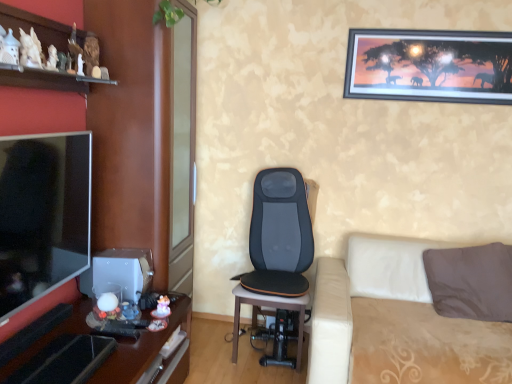
Question: Is metallic-framed picture at upper right thinner than white ceramic figurines at upper left?

Choices:
 (A) no
 (B) yes

Answer: (B)

Question: Does metallic-framed picture at upper right appear on the right side of white ceramic figurines at upper left?

Choices:
 (A) yes
 (B) no

Answer: (A)

Question: Is metallic-framed picture at upper right bigger than white ceramic figurines at upper left?

Choices:
 (A) no
 (B) yes

Answer: (A)

Question: Is metallic-framed picture at upper right beside white ceramic figurines at upper left?

Choices:
 (A) yes
 (B) no

Answer: (B)

Question: Is metallic-framed picture at upper right at the left side of white ceramic figurines at upper left?

Choices:
 (A) yes
 (B) no

Answer: (B)

Question: Is metallic-framed picture at upper right positioned before white ceramic figurines at upper left?

Choices:
 (A) no
 (B) yes

Answer: (A)

Question: From a real-world perspective, is beige fabric studio couch at lower right under black leather massage chair at center?

Choices:
 (A) yes
 (B) no

Answer: (A)

Question: Can you confirm if beige fabric studio couch at lower right is positioned to the right of black leather massage chair at center?

Choices:
 (A) no
 (B) yes

Answer: (B)

Question: Is beige fabric studio couch at lower right aimed at black leather massage chair at center?

Choices:
 (A) no
 (B) yes

Answer: (A)

Question: From a real-world perspective, is beige fabric studio couch at lower right positioned over black leather massage chair at center based on gravity?

Choices:
 (A) no
 (B) yes

Answer: (A)

Question: Considering the relative sizes of beige fabric studio couch at lower right and black leather massage chair at center in the image provided, is beige fabric studio couch at lower right shorter than black leather massage chair at center?

Choices:
 (A) yes
 (B) no

Answer: (A)

Question: From the image's perspective, is beige fabric studio couch at lower right on top of black leather massage chair at center?

Choices:
 (A) no
 (B) yes

Answer: (A)

Question: Does white ceramic figurines at upper left have a larger size compared to beige fabric studio couch at lower right?

Choices:
 (A) yes
 (B) no

Answer: (B)